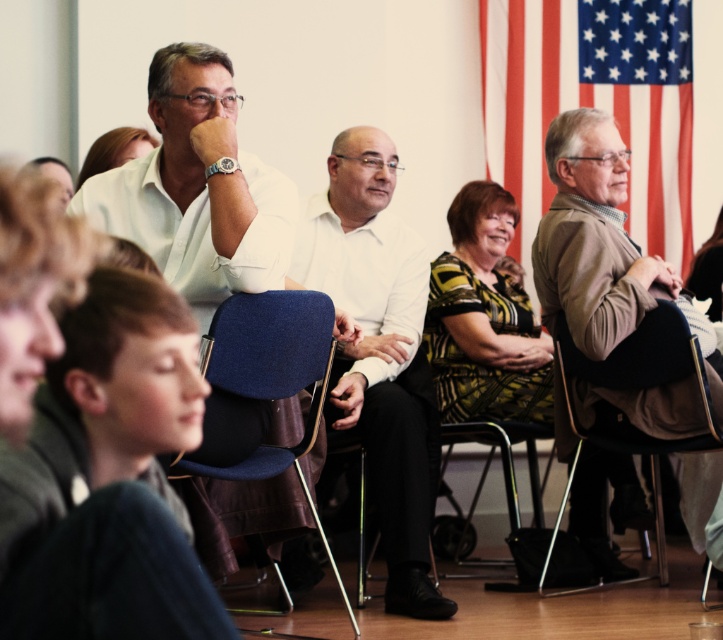
Can you confirm if american flag at upper right is smaller than matte white shirt at upper center?

Incorrect, american flag at upper right is not smaller in size than matte white shirt at upper center.

Does american flag at upper right appear over matte white shirt at upper center?

Correct, american flag at upper right is located above matte white shirt at upper center.

Who is more forward, (611, 12) or (106, 168)?

Positioned in front is point (106, 168).

The height and width of the screenshot is (640, 723). I want to click on american flag at upper right, so click(591, 102).

Does blue fabric chair at center have a lesser width compared to black leather chair at center?

Indeed, blue fabric chair at center has a lesser width compared to black leather chair at center.

Between blue fabric chair at center and black leather chair at center, which one appears on the left side from the viewer's perspective?

From the viewer's perspective, blue fabric chair at center appears more on the left side.

Locate an element on the screen. This screenshot has width=723, height=640. blue fabric chair at center is located at coordinates (270, 378).

Can you confirm if american flag at upper right is positioned to the left of blue fabric chair at center?

Incorrect, american flag at upper right is not on the left side of blue fabric chair at center.

Is point (526, 100) positioned in front of point (208, 472)?

No, (526, 100) is further to viewer.

Does point (586, 93) lie behind point (226, 308)?

That is True.

Image resolution: width=723 pixels, height=640 pixels. I want to click on american flag at upper right, so click(x=591, y=102).